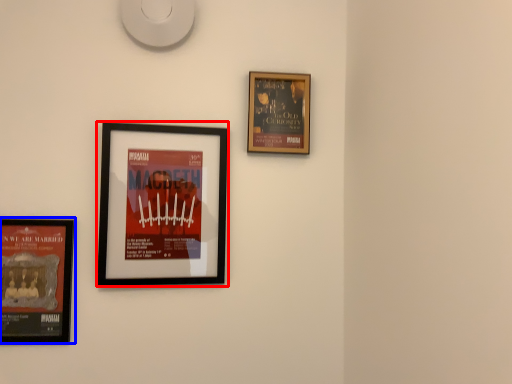
Question: Which point is closer to the camera, picture frame (highlighted by a red box) or picture frame (highlighted by a blue box)?

Choices:
 (A) picture frame
 (B) picture frame

Answer: (B)